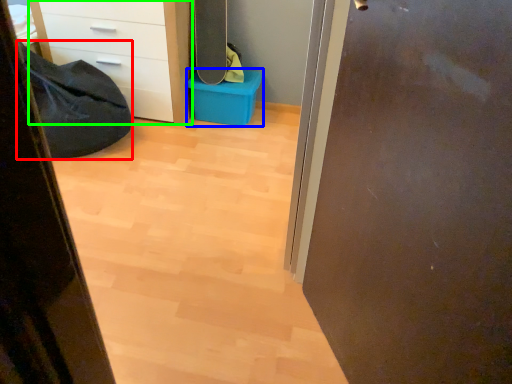
Question: Which object is positioned farthest from sleeping bag (highlighted by a red box)? Select from storage box (highlighted by a blue box) and chest of drawers (highlighted by a green box).

Choices:
 (A) storage box
 (B) chest of drawers

Answer: (A)